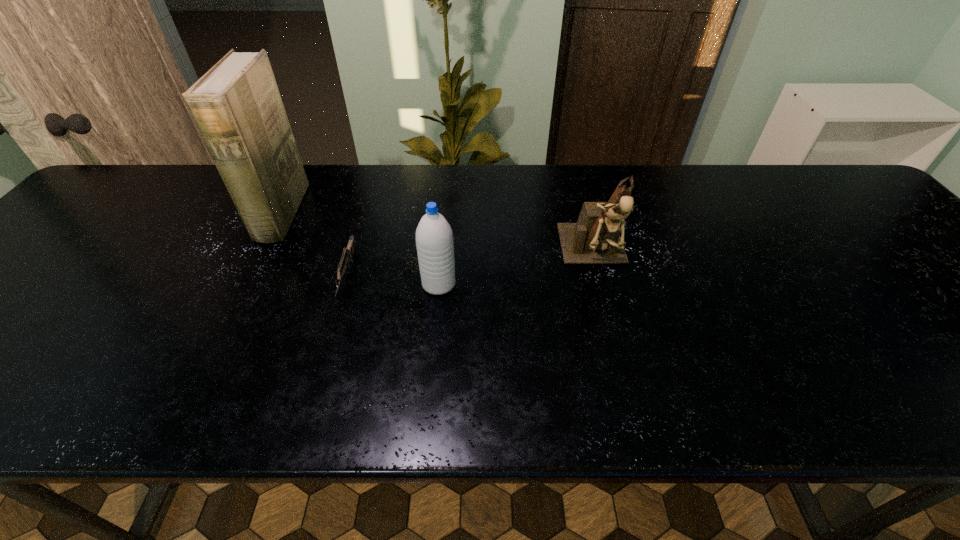
Locate an element on the screen. vacant space located 0.180m on the front of the second shortest object is located at coordinates tap(431, 366).

Find the location of a particular element. The width and height of the screenshot is (960, 540). vacant space located aimed along the barrel of the second object from left to right is located at coordinates (312, 399).

Locate an element on the screen. object at the far edge is located at coordinates (236, 106).

I want to click on blank area at the far edge, so click(448, 192).

Find the location of `vacant space at the near edge of the desktop`. vacant space at the near edge of the desktop is located at coordinates (801, 380).

Find the location of `vacant space at the left edge`. vacant space at the left edge is located at coordinates (97, 217).

Locate an element on the screen. vacant space at the right edge of the desktop is located at coordinates (851, 225).

At what (x,y) coordinates should I click in order to perform the action: click on free space at the far left corner of the desktop. Please return your answer as a coordinate pair (x, y). Image resolution: width=960 pixels, height=540 pixels. Looking at the image, I should click on (121, 179).

In the image, there is a desktop. Where is `blank space at the far right corner`? blank space at the far right corner is located at coordinates (838, 208).

I want to click on vacant space that's between the rightmost object and the gun, so click(471, 266).